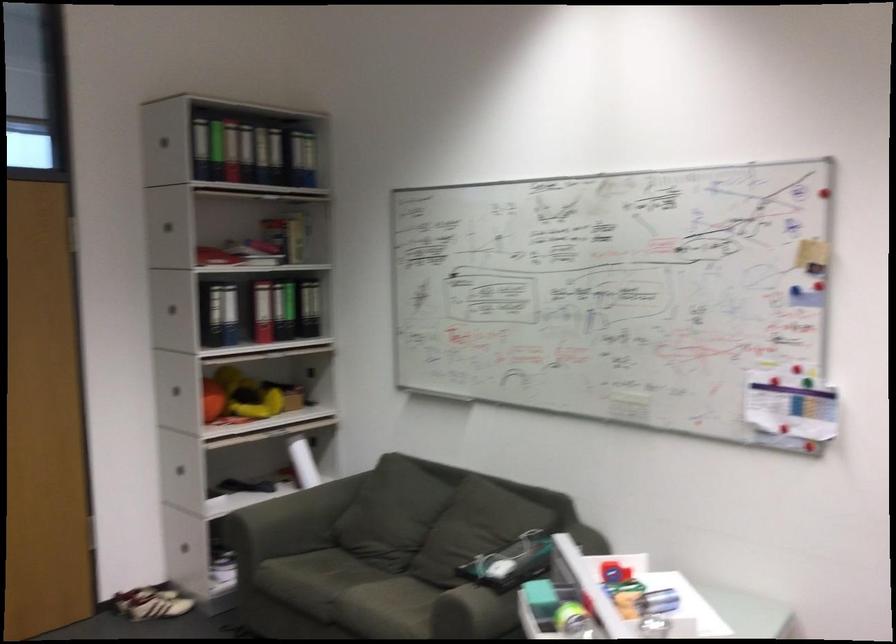
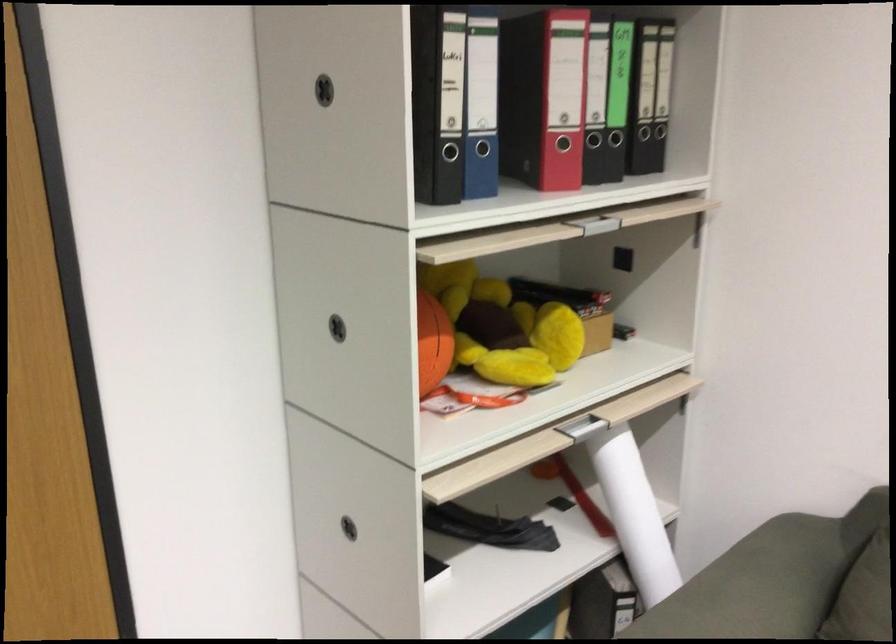
Locate, in the second image, the point that corresponds to pixel 168 315 in the first image.

(326, 86)